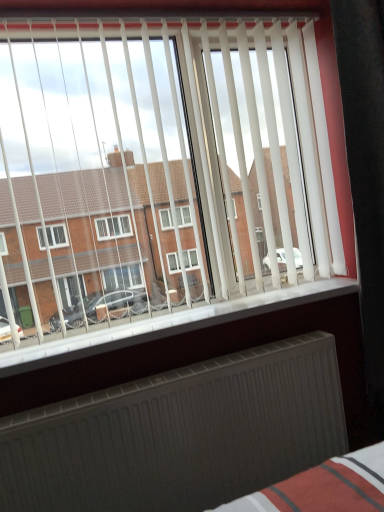
This screenshot has height=512, width=384. What do you see at coordinates (169, 325) in the screenshot?
I see `white plastic window sill at lower center` at bounding box center [169, 325].

Measure the distance between white plastic window sill at lower center and camera.

white plastic window sill at lower center is 1.38 meters from camera.

Locate an element on the screen. This screenshot has width=384, height=512. white plastic window sill at lower center is located at coordinates (169, 325).

In order to face dark gray metallic radiator at bottom, should I rotate leftwards or rightwards?

Rotate right and turn 0.857 degrees.

Find the location of a particular element. The width and height of the screenshot is (384, 512). dark gray metallic radiator at bottom is located at coordinates (180, 434).

Describe the element at coordinates (180, 434) in the screenshot. I see `dark gray metallic radiator at bottom` at that location.

Where is `white plastic window sill at lower center`? The height and width of the screenshot is (512, 384). white plastic window sill at lower center is located at coordinates (169, 325).

Is white plastic window sill at lower center to the left or to the right of dark gray metallic radiator at bottom in the image?

Based on their positions, white plastic window sill at lower center is located to the right of dark gray metallic radiator at bottom.

Considering their positions, is white plastic window sill at lower center located in front of or behind dark gray metallic radiator at bottom?

Clearly, white plastic window sill at lower center is behind dark gray metallic radiator at bottom.

Which is less distant, (234, 319) or (69, 411)?

Clearly, point (234, 319) is more distant from the camera than point (69, 411).

From the image's perspective, which is above, white plastic window sill at lower center or dark gray metallic radiator at bottom?

From the image's view, white plastic window sill at lower center is above.

From the picture: From a real-world perspective, is white plastic window sill at lower center located beneath dark gray metallic radiator at bottom?

No, from a real-world perspective, white plastic window sill at lower center is not below dark gray metallic radiator at bottom.

Which object is wider, white plastic window sill at lower center or dark gray metallic radiator at bottom?

white plastic window sill at lower center is wider.

From their relative heights in the image, would you say white plastic window sill at lower center is taller or shorter than dark gray metallic radiator at bottom?

Clearly, white plastic window sill at lower center is shorter compared to dark gray metallic radiator at bottom.

In the scene shown: Considering the relative sizes of white plastic window sill at lower center and dark gray metallic radiator at bottom in the image provided, is white plastic window sill at lower center smaller than dark gray metallic radiator at bottom?

Correct, white plastic window sill at lower center occupies less space than dark gray metallic radiator at bottom.

Choose the correct answer: Is white plastic window sill at lower center inside dark gray metallic radiator at bottom or outside it?

The correct answer is: outside.

Is white plastic window sill at lower center placed right next to dark gray metallic radiator at bottom?

white plastic window sill at lower center is not next to dark gray metallic radiator at bottom, and they're not touching.

Is white plastic window sill at lower center looking in the opposite direction of dark gray metallic radiator at bottom?

No, dark gray metallic radiator at bottom is not at the back of white plastic window sill at lower center.

How different are the orientations of white plastic window sill at lower center and dark gray metallic radiator at bottom in degrees?

0.331 degrees.

Measure the distance from white plastic window sill at lower center to dark gray metallic radiator at bottom.

white plastic window sill at lower center and dark gray metallic radiator at bottom are 12.52 inches apart.

The height and width of the screenshot is (512, 384). In the image, there is a white plastic window sill at lower center. What are the coordinates of `radiator below it (from the image's perspective)` in the screenshot? It's located at (180, 434).

Between dark gray metallic radiator at bottom and white plastic window sill at lower center, which one appears on the left side from the viewer's perspective?

Positioned to the left is dark gray metallic radiator at bottom.

Is dark gray metallic radiator at bottom in front of or behind white plastic window sill at lower center in the image?

In the image, dark gray metallic radiator at bottom appears in front of white plastic window sill at lower center.

Does point (219, 458) come behind point (30, 348)?

No, it is in front of (30, 348).

From the image's perspective, who appears lower, dark gray metallic radiator at bottom or white plastic window sill at lower center?

From the image's view, dark gray metallic radiator at bottom is below.

From a real-world perspective, which is physically below, dark gray metallic radiator at bottom or white plastic window sill at lower center?

In real-world perspective, dark gray metallic radiator at bottom is lower.

In terms of width, does dark gray metallic radiator at bottom look wider or thinner when compared to white plastic window sill at lower center?

Clearly, dark gray metallic radiator at bottom has less width compared to white plastic window sill at lower center.

In the scene shown: Which of these two, dark gray metallic radiator at bottom or white plastic window sill at lower center, stands taller?

Standing taller between the two is dark gray metallic radiator at bottom.

Between dark gray metallic radiator at bottom and white plastic window sill at lower center, which one has smaller size?

white plastic window sill at lower center.

Is dark gray metallic radiator at bottom situated inside white plastic window sill at lower center or outside?

dark gray metallic radiator at bottom is spatially situated outside white plastic window sill at lower center.

Can you see dark gray metallic radiator at bottom touching white plastic window sill at lower center?

No, dark gray metallic radiator at bottom is not beside white plastic window sill at lower center.

Is white plastic window sill at lower center at the back of dark gray metallic radiator at bottom?

No.

Where is `radiator to the left of white plastic window sill at lower center`? The image size is (384, 512). radiator to the left of white plastic window sill at lower center is located at coordinates (180, 434).

You are a GUI agent. You are given a task and a screenshot of the screen. Output one action in this format:
    pyautogui.click(x=<x>, y=<y>)
    Task: Click on the window sill above the dark gray metallic radiator at bottom (from a real-world perspective)
    The image size is (384, 512).
    Given the screenshot: What is the action you would take?
    pyautogui.click(x=169, y=325)

You are a GUI agent. You are given a task and a screenshot of the screen. Output one action in this format:
    pyautogui.click(x=<x>, y=<y>)
    Task: Click on the radiator below the white plastic window sill at lower center (from the image's perspective)
    This screenshot has height=512, width=384.
    Given the screenshot: What is the action you would take?
    pyautogui.click(x=180, y=434)